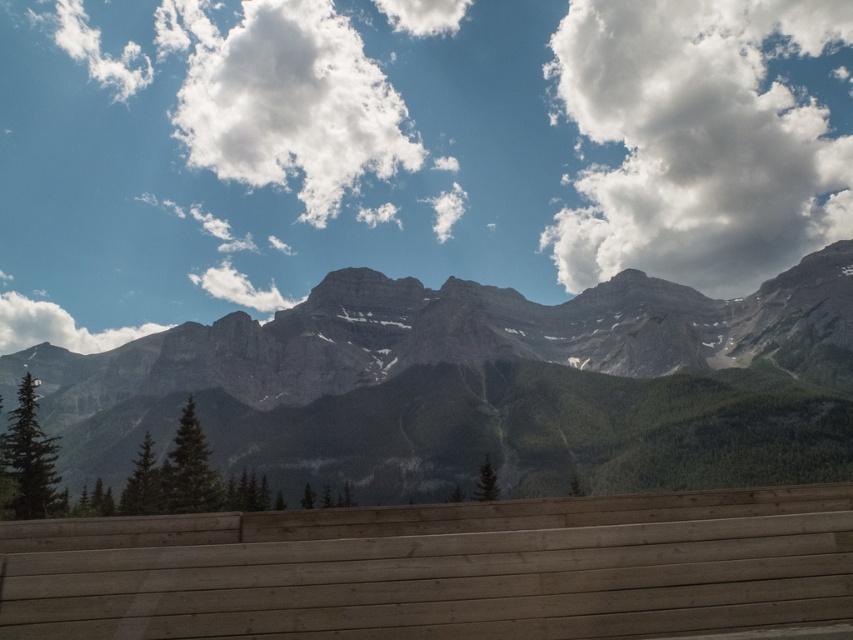
You are visiting a mountain viewpoint and see a natural wood park bench at lower center and a white fluffy cloud at upper center. Which object appears smaller in the image?

The natural wood park bench at lower center appears smaller than the white fluffy cloud at upper center.

You are a hiker who wants to take a photo of the gray rock mountain range at center and the white fluffy cloud at upper right. Which object should you focus on first if you want to capture both in one frame without moving your camera?

The gray rock mountain range at center is shorter than the white fluffy cloud at upper right, so you should focus on the gray rock mountain range at center first to ensure it stays in the frame while adjusting for the taller cloud.